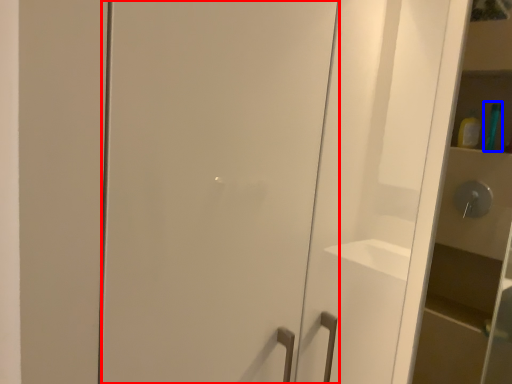
Question: Among these objects, which one is nearest to the camera, door (highlighted by a red box) or toiletry (highlighted by a blue box)?

Choices:
 (A) door
 (B) toiletry

Answer: (A)